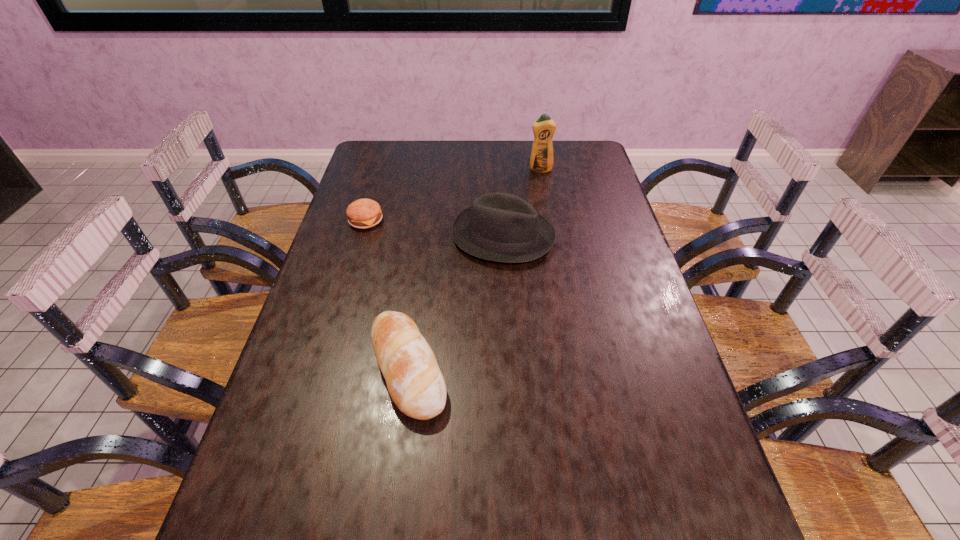
Locate an element on the screen. Image resolution: width=960 pixels, height=540 pixels. vacant point located 0.360m on the right of the leftmost object is located at coordinates (496, 220).

This screenshot has width=960, height=540. Identify the location of object that is at the far edge. (541, 160).

Where is `object that is at the left edge`? This screenshot has height=540, width=960. object that is at the left edge is located at coordinates (364, 213).

Where is `free space at the far edge`? The height and width of the screenshot is (540, 960). free space at the far edge is located at coordinates (410, 170).

This screenshot has height=540, width=960. I want to click on vacant region at the left edge, so click(x=278, y=476).

The height and width of the screenshot is (540, 960). Identify the location of free space at the far left corner. (387, 162).

You are a GUI agent. You are given a task and a screenshot of the screen. Output one action in this format:
    pyautogui.click(x=<x>, y=<y>)
    Task: Click on the vacant space that is in between the bread and the tallest object
    The height and width of the screenshot is (540, 960).
    Given the screenshot: What is the action you would take?
    pyautogui.click(x=474, y=269)

Find the location of a particular element. Image resolution: width=960 pixels, height=540 pixels. free space between the second tallest object and the hamburger is located at coordinates (435, 228).

Image resolution: width=960 pixels, height=540 pixels. Find the location of `free space between the fedora and the hamburger`. free space between the fedora and the hamburger is located at coordinates (435, 228).

At what (x,y) coordinates should I click in order to perform the action: click on free space between the hamburger and the second tallest object. Please return your answer as a coordinate pair (x, y). Image resolution: width=960 pixels, height=540 pixels. Looking at the image, I should click on (435, 228).